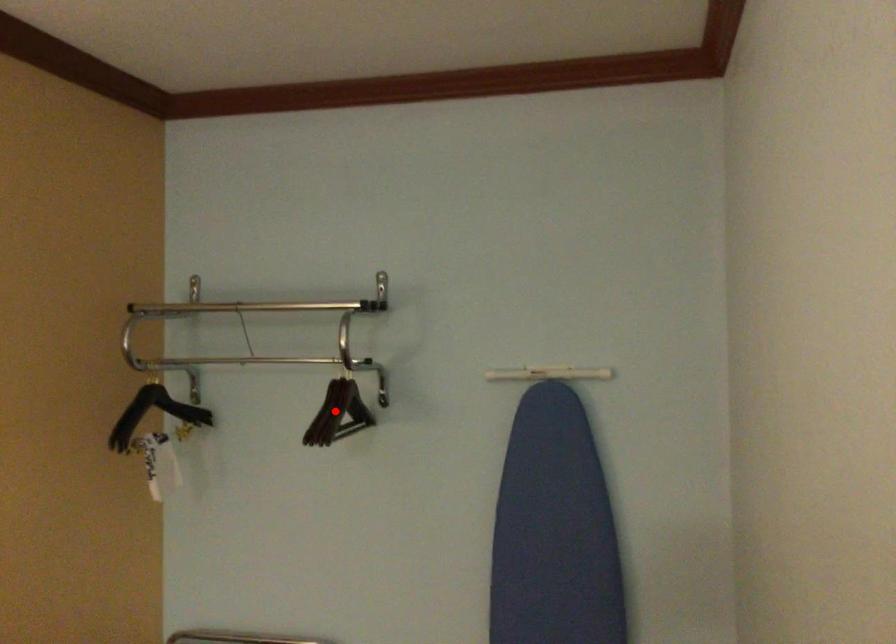
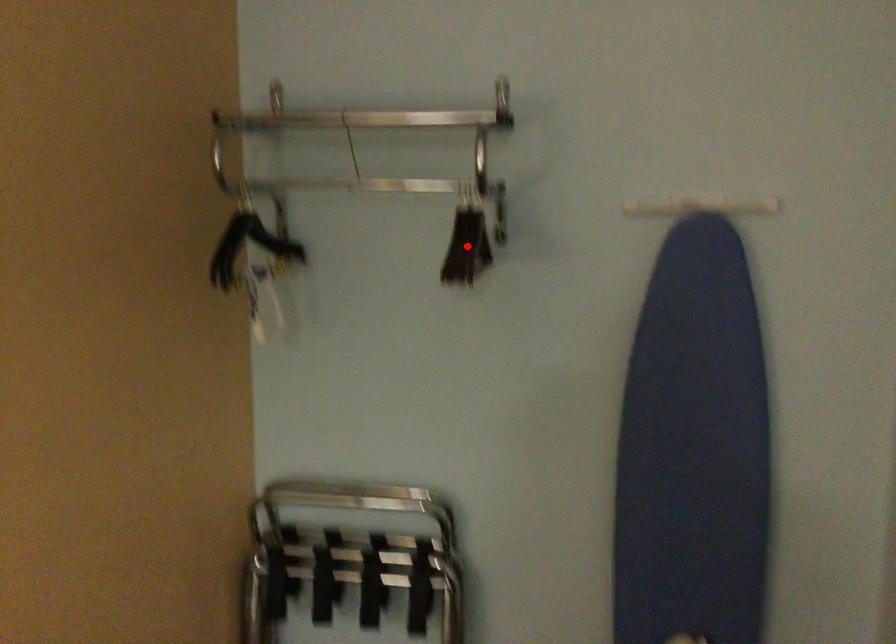
I am providing you with two images of the same scene from different viewpoints. A red point is marked on the first image and another point is marked on the second image. Is the red point in image1 aligned with the point shown in image2?

Yes